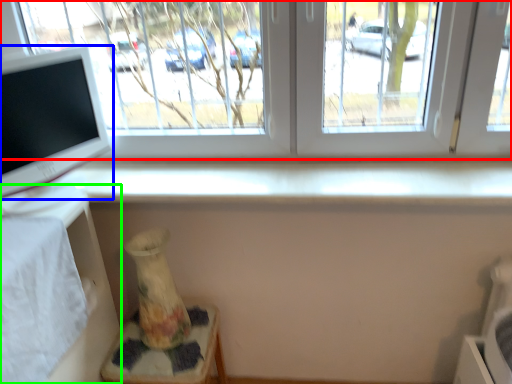
Question: Which object is positioned farthest from window (highlighted by a red box)? Select from computer monitor (highlighted by a blue box) and table (highlighted by a green box).

Choices:
 (A) computer monitor
 (B) table

Answer: (B)